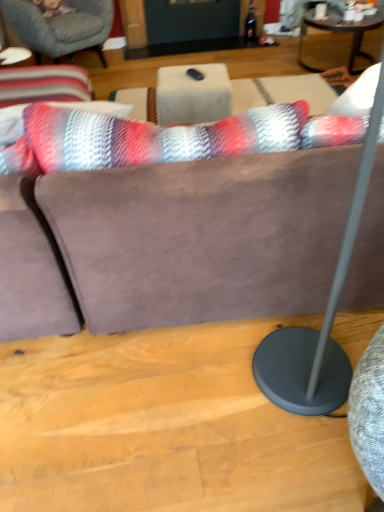
Locate an element on the screen. This screenshot has height=512, width=384. matte gray floor lamp at right is located at coordinates (323, 322).

At what (x,y) coordinates should I click in order to perform the action: click on white marble table at center. Please return your answer as a coordinate pair (x, y). The width and height of the screenshot is (384, 512). Looking at the image, I should click on (193, 94).

Is white marble table at center positioned with its back to striped fabric cushion at upper left?

That's not correct — white marble table at center is not looking away from striped fabric cushion at upper left.

In the scene shown: Who is taller, white marble table at center or striped fabric cushion at upper left?

Standing taller between the two is striped fabric cushion at upper left.

Is white marble table at center next to striped fabric cushion at upper left and touching it?

white marble table at center and striped fabric cushion at upper left are not in contact.

From the image's perspective, does white marble table at center appear higher than striped fabric cushion at upper left?

No, from the image's perspective, white marble table at center is not above striped fabric cushion at upper left.

From a real-world perspective, is striped fabric cushion at upper left physically below white marble table at center?

No, from a real-world perspective, striped fabric cushion at upper left is not beneath white marble table at center.

Is striped fabric cushion at upper left wider than white marble table at center?

Yes.

Which is more to the right, striped fabric cushion at upper left or white marble table at center?

white marble table at center is more to the right.

Between point (331, 27) and point (99, 27), which one is positioned in front?

Positioned in front is point (331, 27).

From the picture: Is the surface of dark brown wooden coffee table at upper right in direct contact with striped fabric cushion at upper left?

There is a gap between dark brown wooden coffee table at upper right and striped fabric cushion at upper left.

Which is more to the left, dark brown wooden coffee table at upper right or striped fabric cushion at upper left?

striped fabric cushion at upper left is more to the left.

Is dark brown wooden coffee table at upper right surrounding striped fabric cushion at upper left?

No, striped fabric cushion at upper left is not inside dark brown wooden coffee table at upper right.

Based on the photo, between matte gray floor lamp at right and striped fabric cushion at upper left, which one has larger size?

striped fabric cushion at upper left is bigger.

Does matte gray floor lamp at right contain striped fabric cushion at upper left?

No, striped fabric cushion at upper left is not surrounded by matte gray floor lamp at right.

Identify the location of chair on the left of matte gray floor lamp at right. (61, 27).

Is matte gray floor lamp at right behind striped fabric cushion at upper left?

No, it is not.

Considering the sizes of objects dark brown wooden coffee table at upper right and matte gray floor lamp at right in the image provided, who is taller, dark brown wooden coffee table at upper right or matte gray floor lamp at right?

matte gray floor lamp at right is taller.

Between dark brown wooden coffee table at upper right and matte gray floor lamp at right, which one is positioned behind?

dark brown wooden coffee table at upper right is further away from the camera.

Which of these two, dark brown wooden coffee table at upper right or matte gray floor lamp at right, is bigger?

Bigger between the two is matte gray floor lamp at right.

Which object is wider, dark brown wooden coffee table at upper right or matte gray floor lamp at right?

Wider between the two is dark brown wooden coffee table at upper right.

Find the location of a particular element. chair above the dark brown wooden coffee table at upper right (from a real-world perspective) is located at coordinates (61, 27).

Considering the sizes of objects striped fabric cushion at upper left and dark brown wooden coffee table at upper right in the image provided, who is wider, striped fabric cushion at upper left or dark brown wooden coffee table at upper right?

With larger width is striped fabric cushion at upper left.

Between striped fabric cushion at upper left and dark brown wooden coffee table at upper right, which one has less height?

dark brown wooden coffee table at upper right is shorter.

How distant is white marble table at center from matte gray floor lamp at right?

They are 4.72 feet apart.

Which is behind, point (205, 94) or point (278, 339)?

The point (205, 94) is more distant.

How different are the orientations of white marble table at center and matte gray floor lamp at right in degrees?

7.39 degrees separate the facing orientations of white marble table at center and matte gray floor lamp at right.

Considering the sizes of white marble table at center and matte gray floor lamp at right in the image, is white marble table at center bigger or smaller than matte gray floor lamp at right?

Considering their sizes, white marble table at center takes up less space than matte gray floor lamp at right.

Where is `table on the right of striped fabric cushion at upper left`? The height and width of the screenshot is (512, 384). table on the right of striped fabric cushion at upper left is located at coordinates (193, 94).

This screenshot has width=384, height=512. In order to click on chair that appears above the white marble table at center (from a real-world perspective) in this screenshot , I will do [x=61, y=27].

Considering their positions, is white marble table at center positioned closer to matte gray floor lamp at right than dark brown wooden coffee table at upper right?

The object closer to matte gray floor lamp at right is white marble table at center.

When comparing their distances from dark brown wooden coffee table at upper right, does white marble table at center or matte gray floor lamp at right seem further?

Based on the image, matte gray floor lamp at right appears to be further to dark brown wooden coffee table at upper right.

From the picture: Considering their positions, is dark brown wooden coffee table at upper right positioned closer to striped fabric cushion at upper left than white marble table at center?

The object closer to striped fabric cushion at upper left is white marble table at center.

From the image, which object appears to be farther from striped fabric cushion at upper left, white marble table at center or matte gray floor lamp at right?

Among the two, matte gray floor lamp at right is located further to striped fabric cushion at upper left.

When comparing their distances from striped fabric cushion at upper left, does matte gray floor lamp at right or dark brown wooden coffee table at upper right seem further?

matte gray floor lamp at right is further to striped fabric cushion at upper left.

When comparing their distances from dark brown wooden coffee table at upper right, does white marble table at center or striped fabric cushion at upper left seem closer?

white marble table at center is closer to dark brown wooden coffee table at upper right.

Based on their spatial positions, is white marble table at center or striped fabric cushion at upper left further from matte gray floor lamp at right?

The object further to matte gray floor lamp at right is striped fabric cushion at upper left.

Which object lies nearer to the anchor point white marble table at center, striped fabric cushion at upper left or matte gray floor lamp at right?

Among the two, matte gray floor lamp at right is located nearer to white marble table at center.

Find the location of a particular element. table positioned between matte gray floor lamp at right and dark brown wooden coffee table at upper right from near to far is located at coordinates (193, 94).

In order to click on table between striped fabric cushion at upper left and dark brown wooden coffee table at upper right in this screenshot , I will do `click(193, 94)`.

Locate an element on the screen. The height and width of the screenshot is (512, 384). table between matte gray floor lamp at right and striped fabric cushion at upper left in the front-back direction is located at coordinates (193, 94).

What are the coordinates of `chair between matte gray floor lamp at right and dark brown wooden coffee table at upper right from front to back` in the screenshot? It's located at (61, 27).